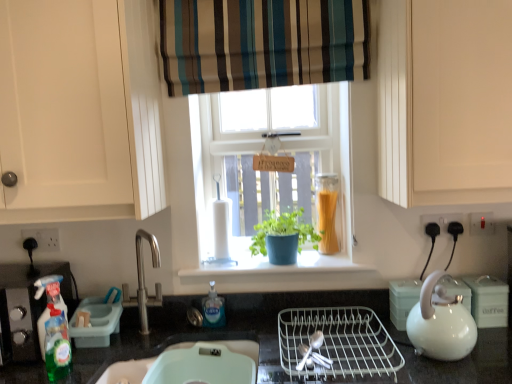
Measure the distance between point (58,378) and camera.

1.33 meters.

I want to click on white plastic dish rack at lower left, so click(x=25, y=307).

The width and height of the screenshot is (512, 384). Describe the element at coordinates (440, 322) in the screenshot. I see `white glossy kettle at right` at that location.

In order to click on white glossy kettle at right in this screenshot , I will do `click(440, 322)`.

The height and width of the screenshot is (384, 512). I want to click on blue textured pot at center, so click(283, 237).

Identify the location of cleaning product located in front of the clear plastic bottle at lower center, which is counted as the 1th bottle, starting from the back. The image size is (512, 384). (52, 292).

Is translucent plastic spray bottle at left positioned behind clear plastic bottle at lower center, which is counted as the 1th bottle, starting from the back?

No, translucent plastic spray bottle at left is closer to the camera.

In terms of height, does translucent plastic spray bottle at left look taller or shorter compared to clear plastic bottle at lower center, which is counted as the 1th bottle, starting from the back?

translucent plastic spray bottle at left is taller than clear plastic bottle at lower center, which is counted as the 1th bottle, starting from the back.

Is translucent plastic spray bottle at left wider than clear plastic bottle at lower center, the 2th bottle positioned from the front?

Yes, translucent plastic spray bottle at left is wider than clear plastic bottle at lower center, the 2th bottle positioned from the front.

Is point (302, 184) positioned after point (212, 297)?

Yes, it is behind point (212, 297).

Between green matte plant pot at center and clear plastic bottle at lower center, positioned as the second bottle in left-to-right order, which one has more height?

Standing taller between the two is green matte plant pot at center.

Does green matte plant pot at center come behind clear plastic bottle at lower center, which is counted as the 1th bottle, starting from the back?

Yes, green matte plant pot at center is further from the viewer.

From the picture: Is green matte plant pot at center facing away from clear plastic bottle at lower center, the 2th bottle positioned from the front?

No, green matte plant pot at center's orientation is not away from clear plastic bottle at lower center, the 2th bottle positioned from the front.

From the image's perspective, which is above, green plastic dish soap dispenser at left, which ranks as the fourth appliance in right-to-left order, or translucent plastic spray bottle at left?

translucent plastic spray bottle at left, from the image's perspective.

Is green plastic dish soap dispenser at left, which ranks as the fourth appliance in right-to-left order, at the left side of translucent plastic spray bottle at left?

No.

From a real-world perspective, is green plastic dish soap dispenser at left, the first appliance positioned from the left, below translucent plastic spray bottle at left?

Indeed, from a real-world perspective, green plastic dish soap dispenser at left, the first appliance positioned from the left, is positioned beneath translucent plastic spray bottle at left.

Is green plastic dish soap dispenser at left, which ranks as the fourth appliance in right-to-left order, located outside translucent plastic spray bottle at left?

Yes.

Based on the photo, do you think striped fabric curtain at upper center is within green matte plant pot at center, or outside of it?

striped fabric curtain at upper center lies outside green matte plant pot at center.

From a real-world perspective, which object rests below the other?

In real-world perspective, green matte plant pot at center is lower.

Which is more to the right, striped fabric curtain at upper center or green matte plant pot at center?

green matte plant pot at center.

Is the depth of striped fabric curtain at upper center greater than that of green matte plant pot at center?

No, it is not.

The width and height of the screenshot is (512, 384). I want to click on cleaning product beneath the translucent glass jar at window (from a real-world perspective), so click(x=52, y=292).

Looking at this image, between translucent plastic spray bottle at left and translucent glass jar at window, which one has smaller size?

translucent plastic spray bottle at left.

What's the angular difference between translucent plastic spray bottle at left and translucent glass jar at window's facing directions?

translucent plastic spray bottle at left and translucent glass jar at window are facing 42.4 degrees away from each other.

From a real-world perspective, between translucent plastic spray bottle at left and translucent glass jar at window, who is vertically higher?

translucent glass jar at window.

How many degrees apart are the facing directions of white glossy teapot at right, acting as the third appliance starting from the left, and green translucent bottle at lower left, the first bottle when ordered from left to right?

white glossy teapot at right, acting as the third appliance starting from the left, and green translucent bottle at lower left, the first bottle when ordered from left to right, are facing 26.4 degrees away from each other.

Identify the location of bottle lying in front of the white glossy teapot at right, acting as the third appliance starting from the left. Image resolution: width=512 pixels, height=384 pixels. (57, 345).

From their relative heights in the image, would you say white glossy teapot at right, acting as the third appliance starting from the left, is taller or shorter than green translucent bottle at lower left, which is counted as the second bottle, starting from the back?

white glossy teapot at right, acting as the third appliance starting from the left, is shorter than green translucent bottle at lower left, which is counted as the second bottle, starting from the back.

From a real-world perspective, between white glossy teapot at right, acting as the third appliance starting from the left, and green translucent bottle at lower left, acting as the first bottle starting from the front, who is vertically lower?

white glossy teapot at right, acting as the third appliance starting from the left.

Is the surface of green plastic dish soap dispenser at left, which ranks as the fourth appliance in right-to-left order, in direct contact with white ceramic kettle at right, placed as the 4th appliance when sorted from left to right?

No, green plastic dish soap dispenser at left, which ranks as the fourth appliance in right-to-left order, is not touching white ceramic kettle at right, placed as the 4th appliance when sorted from left to right.

Identify the location of appliance above the white ceramic kettle at right, placed as the 4th appliance when sorted from left to right (from a real-world perspective). The image size is (512, 384). (97, 320).

Considering the relative sizes of green plastic dish soap dispenser at left, which ranks as the fourth appliance in right-to-left order, and white ceramic kettle at right, placed as the 4th appliance when sorted from left to right, in the image provided, is green plastic dish soap dispenser at left, which ranks as the fourth appliance in right-to-left order, shorter than white ceramic kettle at right, placed as the 4th appliance when sorted from left to right,?

Correct, green plastic dish soap dispenser at left, which ranks as the fourth appliance in right-to-left order, is not as tall as white ceramic kettle at right, placed as the 4th appliance when sorted from left to right.

From the image's perspective, which one is positioned higher, green plastic dish soap dispenser at left, the first appliance positioned from the left, or white ceramic kettle at right, placed as the 1th appliance when sorted from right to left?

From the image's view, white ceramic kettle at right, placed as the 1th appliance when sorted from right to left, is above.

This screenshot has width=512, height=384. In order to click on cleaning product above the clear plastic bottle at lower center, which is counted as the 1th bottle, starting from the back (from the image's perspective) in this screenshot , I will do `click(52, 292)`.

From the image's perspective, count 1st bottles downward from the green matte plant pot at center and point to it. Please provide its 2D coordinates.

[(213, 309)]

Based on their spatial positions, is translucent glass jar at window or clear plastic bottle at lower center, which is counted as the 1th bottle, starting from the back, closer to green matte plant pot at center?

translucent glass jar at window.

Considering their positions, is translucent plastic spray bottle at left positioned closer to clear plastic bottle at lower center, positioned as the second bottle in left-to-right order, than matte white sink at lower center?

Among the two, matte white sink at lower center is located nearer to clear plastic bottle at lower center, positioned as the second bottle in left-to-right order.

Estimate the real-world distances between objects in this image. Which object is closer to white plastic dish rack at lower left, white ceramic kettle at right, placed as the 4th appliance when sorted from left to right, or white wire dish rack at center, which is the third appliance in right-to-left order?

white wire dish rack at center, which is the third appliance in right-to-left order, is positioned closer to the anchor white plastic dish rack at lower left.

Which object lies nearer to the anchor point clear plastic bottle at lower center, which is counted as the 1th bottle, starting from the back, green translucent bottle at lower left, which appears as the second bottle when viewed from the right, or blue textured pot at center?

Based on the image, blue textured pot at center appears to be nearer to clear plastic bottle at lower center, which is counted as the 1th bottle, starting from the back.

Which object lies further to the anchor point white glossy kettle at right, white wire dish rack at center, the 2th appliance when ordered from left to right, or green translucent bottle at lower left, acting as the first bottle starting from the front?

Among the two, green translucent bottle at lower left, acting as the first bottle starting from the front, is located further to white glossy kettle at right.

Considering their positions, is white ceramic kettle at right, placed as the 1th appliance when sorted from right to left, positioned closer to clear plastic bottle at lower center, the 2th bottle positioned from the front, than translucent plastic spray bottle at left?

The object closer to clear plastic bottle at lower center, the 2th bottle positioned from the front, is translucent plastic spray bottle at left.

Considering their positions, is matte white sink at lower center positioned closer to translucent glass jar at window than white plastic dish rack at lower left?

The object closer to translucent glass jar at window is matte white sink at lower center.

Considering their positions, is striped fabric curtain at upper center positioned further to white plastic dish rack at lower left than green plastic dish soap dispenser at left, the first appliance positioned from the left?

striped fabric curtain at upper center.

Where is `sink located between translucent plastic spray bottle at left and white glossy kettle at right in the left-right direction`? The height and width of the screenshot is (384, 512). sink located between translucent plastic spray bottle at left and white glossy kettle at right in the left-right direction is located at coordinates (126, 371).

Where is `appliance located between white plastic dish rack at lower left and clear plastic bottle at lower center, the 2th bottle positioned from the front, in the left-right direction`? This screenshot has width=512, height=384. appliance located between white plastic dish rack at lower left and clear plastic bottle at lower center, the 2th bottle positioned from the front, in the left-right direction is located at coordinates (97, 320).

Locate an element on the screen. appliance between translucent plastic spray bottle at left and clear plastic bottle at lower center, the 2th bottle positioned from the front is located at coordinates (97, 320).

Where is `houseplant between green translucent bottle at lower left, which is counted as the second bottle, starting from the back, and white glossy kettle at right from left to right`? This screenshot has width=512, height=384. houseplant between green translucent bottle at lower left, which is counted as the second bottle, starting from the back, and white glossy kettle at right from left to right is located at coordinates (283, 237).